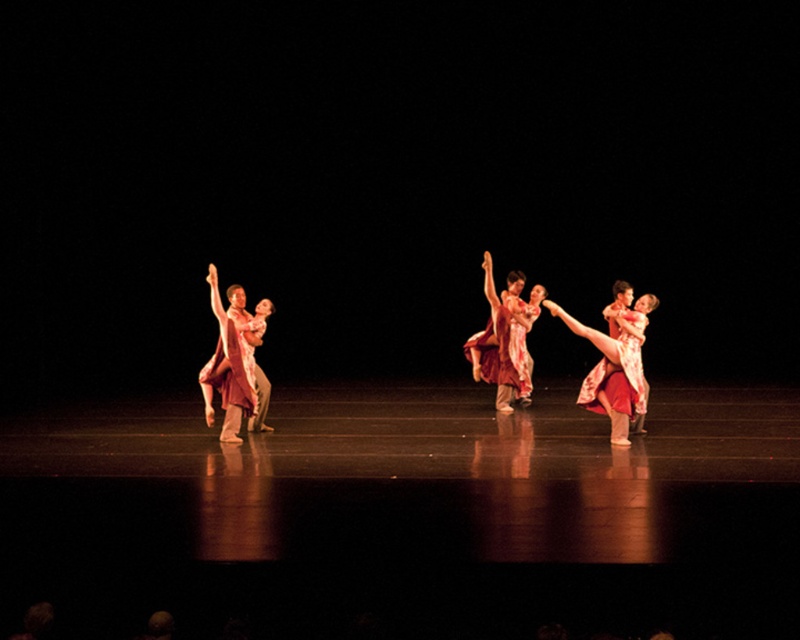
You are a stage director observing the dance performance. You need to adjust the spotlight so it focuses on the point that is further away from the audience. Which point should you choose between point (626, 444) and point (506, 403)?

Point (506, 403) is further away from the audience because it is behind point (626, 444).

You are a photographer positioned at the back of the stage. You want to capture a photo where both the matte pink dress at right and the matte red dress at center are clearly visible. Considering their positions, which dress might partially block the other?

The matte pink dress at right is in front of the matte red dress at center, so it might partially block the matte red dress at center in the photo.